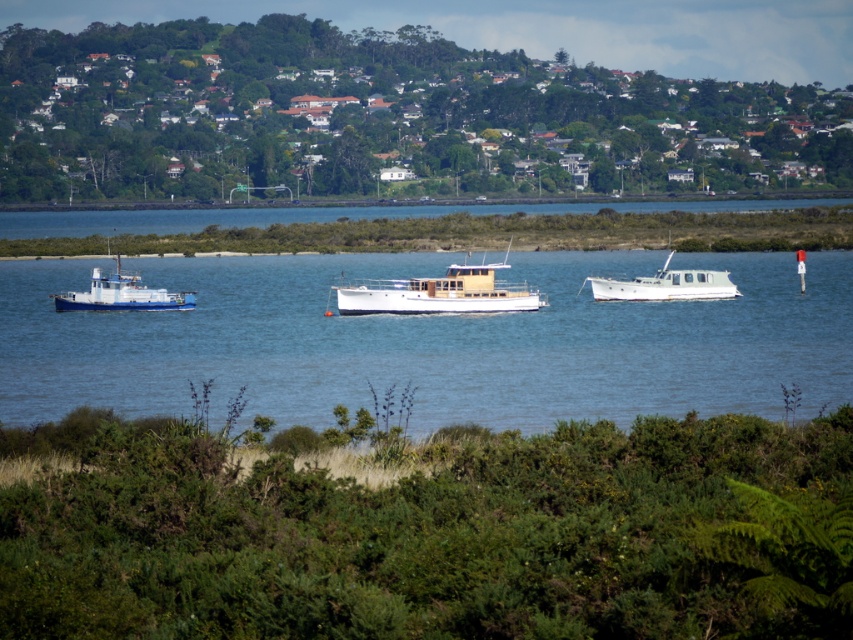
Can you confirm if blue metallic water at center is wider than white matte boat at center?

Correct, the width of blue metallic water at center exceeds that of white matte boat at center.

What do you see at coordinates (430, 340) in the screenshot? I see `blue metallic water at center` at bounding box center [430, 340].

Is point (91, 396) more distant than point (712, 273)?

No.

Locate an element on the screen. blue metallic water at center is located at coordinates (430, 340).

Does wooden cabin cruiser at center have a lesser height compared to white matte boat at center?

No, wooden cabin cruiser at center is not shorter than white matte boat at center.

Which is behind, point (410, 291) or point (622, 292)?

Point (622, 292)

The height and width of the screenshot is (640, 853). Describe the element at coordinates (439, 292) in the screenshot. I see `wooden cabin cruiser at center` at that location.

Where is `wooden cabin cruiser at center`? The width and height of the screenshot is (853, 640). wooden cabin cruiser at center is located at coordinates (439, 292).

Does point (341, 298) come closer to viewer compared to point (163, 291)?

Yes.

Which is behind, point (438, 296) or point (154, 308)?

Positioned behind is point (154, 308).

The image size is (853, 640). I want to click on wooden cabin cruiser at center, so click(x=439, y=292).